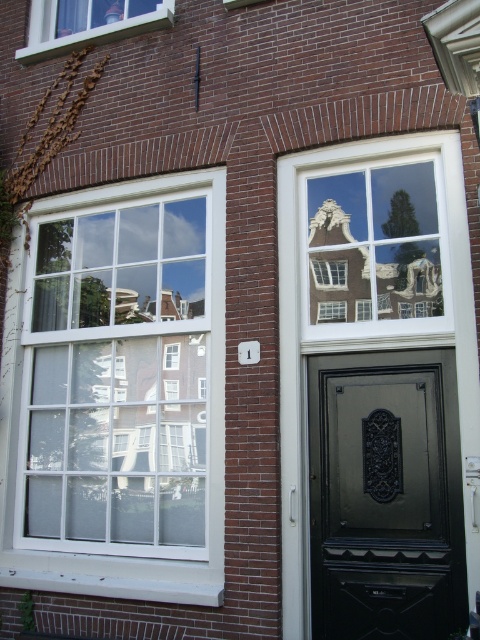
You are standing in front of the brick building and want to determine the spatial relationship between two points marked on the building. The first point is located at coordinates point (x=124, y=417) and the second at point (x=422, y=448). Based on the image description, which point is closer to the viewer?

Point (x=124, y=417) is behind point (x=422, y=448), so the point closer to the viewer is point (x=422, y=448).

You are standing in front of a brick building and see the white glass window at upper left. If you want to reach the window, which direction should you move relative to your current position?

The white glass window at upper left is located at point 0.616 on the x axis and 0.244 on the y axis. Since the window is at upper left, you should move towards the upper left direction to reach it.

Looking at this image, you are standing in front of a brick building and see the white glass window at upper left and the matte white window at upper left. Which window is nearer to you?

The white glass window at upper left is closer to the viewer than the matte white window at upper left.